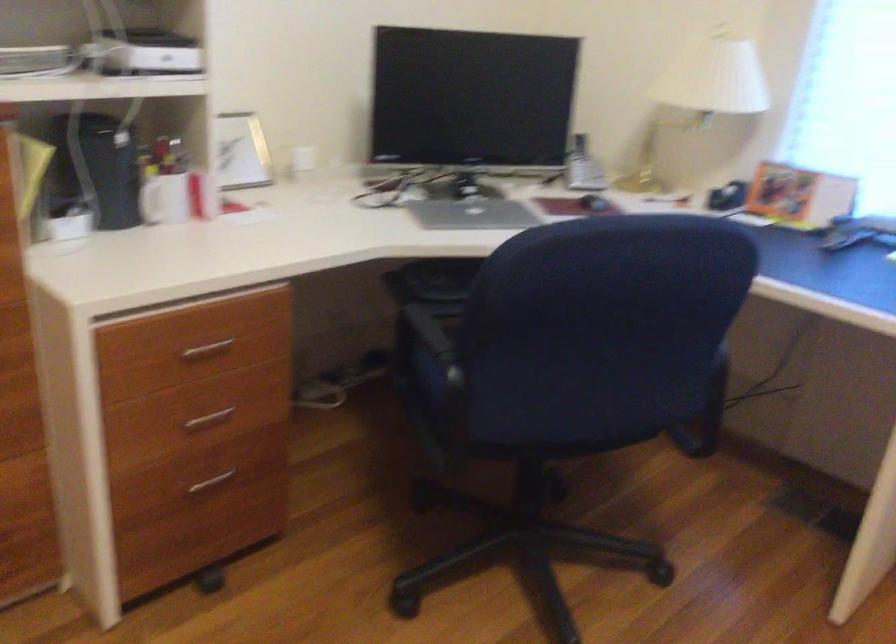
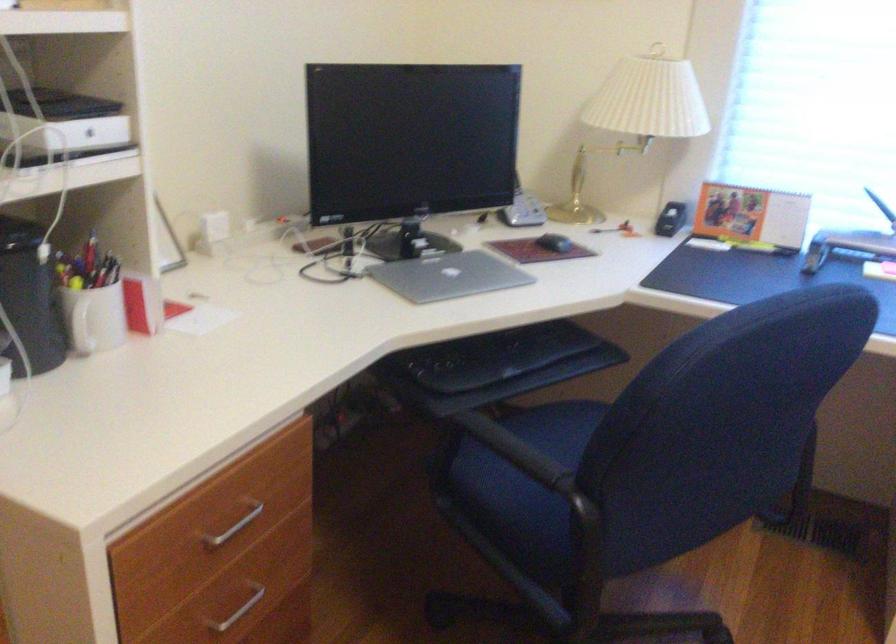
Locate, in the second image, the point that corresponds to the point at 213,428 in the first image.

(238, 611)